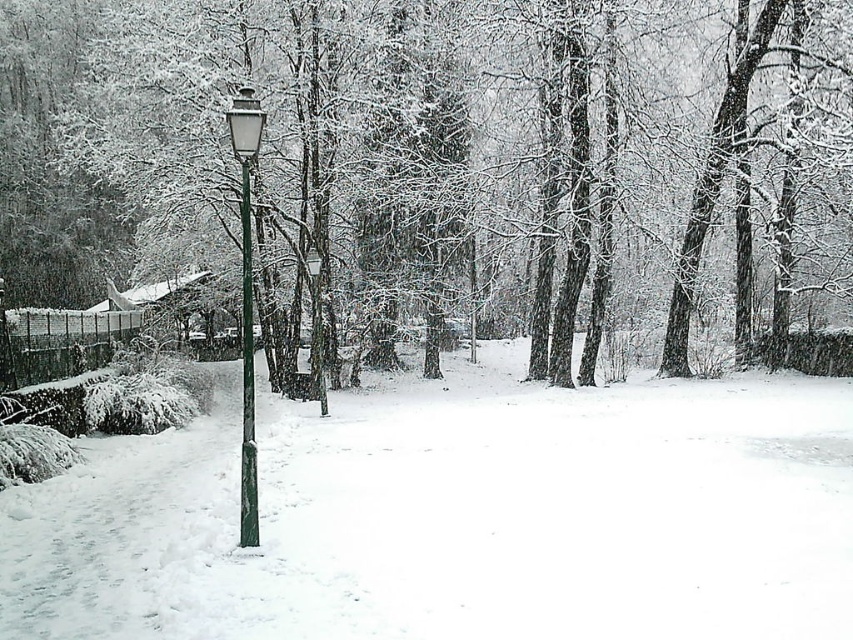
Between green matte lamp post at left and green metallic pole at center, which one is positioned lower?

green matte lamp post at left is lower down.

Which is in front, point (241, 461) or point (248, 305)?

Point (248, 305) is more forward.

Is point (247, 141) farther from camera compared to point (244, 499)?

That is False.

This screenshot has height=640, width=853. Find the location of `green matte lamp post at left`. green matte lamp post at left is located at coordinates (247, 301).

Who is more forward, (38, 589) or (245, 285)?

Positioned in front is point (38, 589).

How much distance is there between white fluffy snow at center and green matte lamp post at left?

white fluffy snow at center is 18.17 feet from green matte lamp post at left.

Who is more forward, (216, 504) or (254, 540)?

Point (254, 540) is more forward.

Identify the location of white fluffy snow at center. The height and width of the screenshot is (640, 853). (457, 516).

Is white fluffy snow at center above green metallic pole at center?

Incorrect, white fluffy snow at center is not positioned above green metallic pole at center.

Can you confirm if white fluffy snow at center is positioned to the right of green metallic pole at center?

Correct, you'll find white fluffy snow at center to the right of green metallic pole at center.

Does point (509, 563) lie in front of point (244, 397)?

Yes, it is in front of point (244, 397).

You are a GUI agent. You are given a task and a screenshot of the screen. Output one action in this format:
    pyautogui.click(x=<x>, y=<y>)
    Task: Click on the white fluffy snow at center
    The height and width of the screenshot is (640, 853).
    Given the screenshot: What is the action you would take?
    pyautogui.click(x=457, y=516)